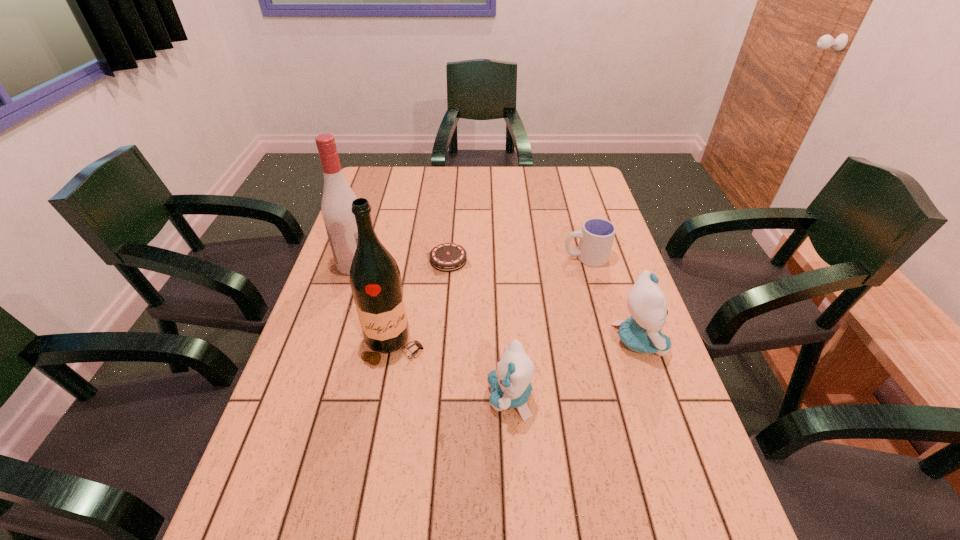
I want to click on the shorter kitten, so point(510,385).

This screenshot has height=540, width=960. What are the coordinates of `the nearest object` in the screenshot? It's located at (510, 385).

This screenshot has width=960, height=540. In order to click on the taller kitten in this screenshot , I will do `click(641, 332)`.

Find the location of a particular element. The image size is (960, 540). the farther kitten is located at coordinates (641, 332).

Identify the location of wine bottle. The image size is (960, 540). (375, 279).

In order to click on chocolate cake in this screenshot , I will do `click(448, 257)`.

At what (x,y) coordinates should I click in order to perform the action: click on cup. Please return your answer as a coordinate pair (x, y). Image resolution: width=960 pixels, height=540 pixels. Looking at the image, I should click on (597, 235).

Identify the location of alcohol. (336, 207).

Find the location of `free space located on the face of the third shortest object`. free space located on the face of the third shortest object is located at coordinates (434, 397).

Image resolution: width=960 pixels, height=540 pixels. I want to click on vacant space situated on the face of the third shortest object, so click(x=354, y=397).